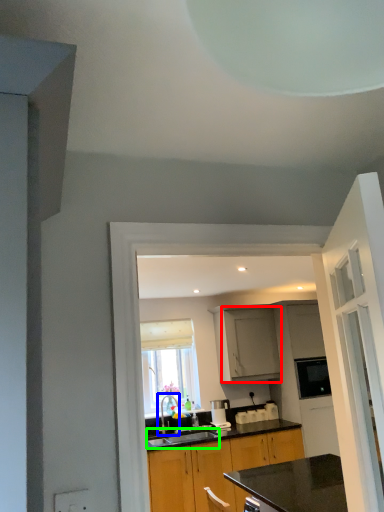
Question: Which is nearer to the cabinetry (highlighted by a red box)? tap (highlighted by a blue box) or sink (highlighted by a green box).

Choices:
 (A) tap
 (B) sink

Answer: (B)